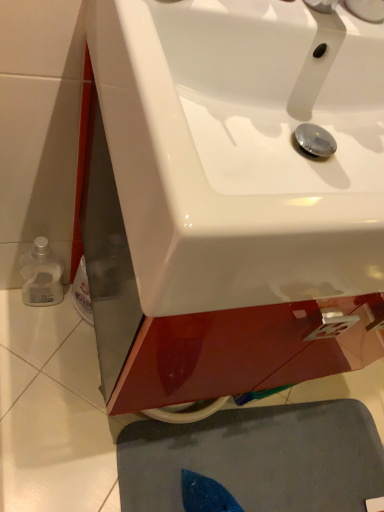
Measure the distance between white glossy sink at center and camera.

31.56 centimeters.

What do you see at coordinates (242, 149) in the screenshot?
I see `white glossy sink at center` at bounding box center [242, 149].

I want to click on white glossy sink at center, so click(242, 149).

You are a GUI agent. You are given a task and a screenshot of the screen. Output one action in this format:
    pyautogui.click(x=<x>, y=<y>)
    Task: Click on the gray matte bath mat at lower center
    The width and height of the screenshot is (384, 512).
    Given the screenshot: What is the action you would take?
    pyautogui.click(x=258, y=458)

Image resolution: width=384 pixels, height=512 pixels. What do you see at coordinates (258, 458) in the screenshot?
I see `gray matte bath mat at lower center` at bounding box center [258, 458].

Where is `white glossy sink at center`? The width and height of the screenshot is (384, 512). white glossy sink at center is located at coordinates (242, 149).

Which object is positioned more to the right, gray matte bath mat at lower center or white glossy sink at center?

From the viewer's perspective, gray matte bath mat at lower center appears more on the right side.

Is gray matte bath mat at lower center further to the viewer compared to white glossy sink at center?

Yes, gray matte bath mat at lower center is further from the camera.

Does point (147, 497) appear closer or farther from the camera than point (334, 15)?

Clearly, point (147, 497) is more distant from the camera than point (334, 15).

From the image's perspective, is gray matte bath mat at lower center located beneath white glossy sink at center?

Yes, from the image's perspective, gray matte bath mat at lower center is beneath white glossy sink at center.

From a real-world perspective, which is physically above, gray matte bath mat at lower center or white glossy sink at center?

white glossy sink at center, from a real-world perspective.

Between gray matte bath mat at lower center and white glossy sink at center, which one has smaller width?

With smaller width is white glossy sink at center.

Considering the relative sizes of gray matte bath mat at lower center and white glossy sink at center in the image provided, is gray matte bath mat at lower center shorter than white glossy sink at center?

Indeed, gray matte bath mat at lower center has a lesser height compared to white glossy sink at center.

Looking at this image, who is bigger, gray matte bath mat at lower center or white glossy sink at center?

Bigger between the two is white glossy sink at center.

Is white glossy sink at center located within gray matte bath mat at lower center?

No, gray matte bath mat at lower center does not contain white glossy sink at center.

Would you say gray matte bath mat at lower center is a long distance from white glossy sink at center?

No.

Could you tell me if gray matte bath mat at lower center is turned towards white glossy sink at center?

No, gray matte bath mat at lower center does not turn towards white glossy sink at center.

What's the angular difference between gray matte bath mat at lower center and white glossy sink at center's facing directions?

The angular difference between gray matte bath mat at lower center and white glossy sink at center is 82.9 degrees.

This screenshot has height=512, width=384. In the image, there is a white glossy sink at center. What are the coordinates of `bath mat below it (from the image's perspective)` in the screenshot? It's located at (258, 458).

Between white glossy sink at center and gray matte bath mat at lower center, which one appears on the left side from the viewer's perspective?

Positioned to the left is white glossy sink at center.

Between white glossy sink at center and gray matte bath mat at lower center, which one is positioned in front?

white glossy sink at center is closer to the camera.

Does point (277, 34) lie behind point (284, 410)?

No, (277, 34) is closer to viewer.

From the image's perspective, is white glossy sink at center below gray matte bath mat at lower center?

No, from the image's perspective, white glossy sink at center is not below gray matte bath mat at lower center.

From a real-world perspective, is white glossy sink at center positioned above or below gray matte bath mat at lower center?

In terms of real-world spatial position, white glossy sink at center is above gray matte bath mat at lower center.

From the picture: Which object is wider, white glossy sink at center or gray matte bath mat at lower center?

gray matte bath mat at lower center.

In terms of height, does white glossy sink at center look taller or shorter compared to gray matte bath mat at lower center?

Considering their sizes, white glossy sink at center has more height than gray matte bath mat at lower center.

Which of these two, white glossy sink at center or gray matte bath mat at lower center, is smaller?

gray matte bath mat at lower center is smaller.

Is white glossy sink at center not within gray matte bath mat at lower center?

Yes, white glossy sink at center is outside of gray matte bath mat at lower center.

Can you see white glossy sink at center touching gray matte bath mat at lower center?

They are not placed beside each other.

Could you tell me if white glossy sink at center is turned towards gray matte bath mat at lower center?

No.

Identify the location of bath mat below the white glossy sink at center (from the image's perspective). (258, 458).

Locate an element on the screen. sink above the gray matte bath mat at lower center (from a real-world perspective) is located at coordinates (242, 149).

The height and width of the screenshot is (512, 384). I want to click on sink above the gray matte bath mat at lower center (from the image's perspective), so click(x=242, y=149).